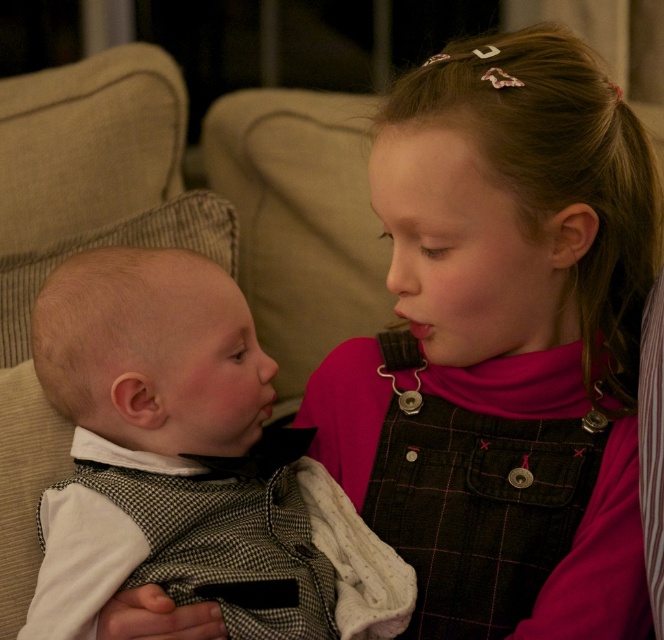
Does point (499, 152) lie in front of point (207, 448)?

Yes, point (499, 152) is closer to viewer.

Between point (410, 118) and point (203, 563), which one is positioned behind?

Point (410, 118)

Locate an element on the screen. This screenshot has height=640, width=664. pink cotton dress at center is located at coordinates (503, 342).

The height and width of the screenshot is (640, 664). Identify the location of pink cotton dress at center. (503, 342).